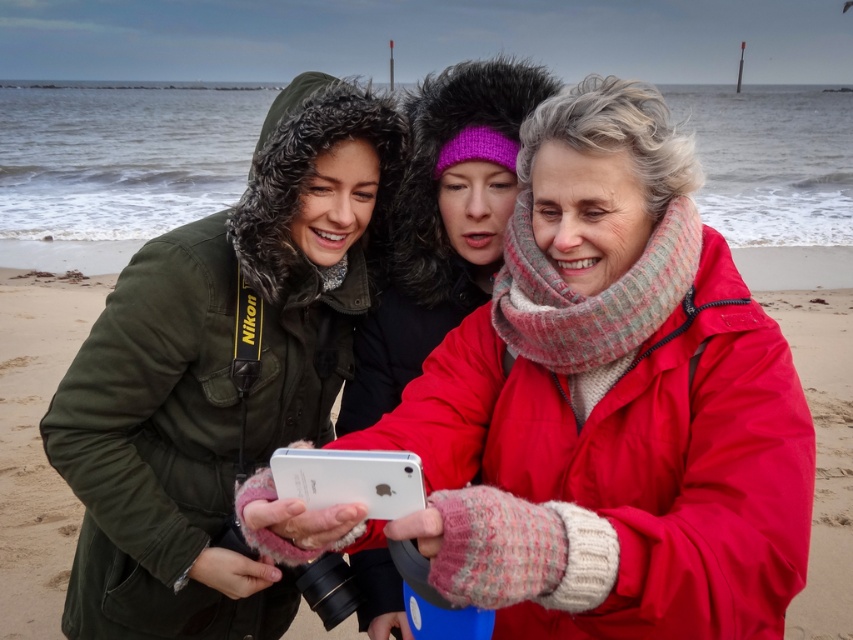
Does matte black jacket at left have a greater height compared to knitted pink scarf at center?

Indeed, matte black jacket at left has a greater height compared to knitted pink scarf at center.

Between matte black jacket at left and knitted pink scarf at center, which one has less height?

knitted pink scarf at center

What do you see at coordinates (219, 374) in the screenshot? The height and width of the screenshot is (640, 853). I see `matte black jacket at left` at bounding box center [219, 374].

This screenshot has width=853, height=640. What are the coordinates of `matte black jacket at left` in the screenshot? It's located at (219, 374).

Is matte black jacket at left positioned at the back of sandy beach at center?

No, it is in front of sandy beach at center.

Between point (202, 554) and point (35, 355), which one is positioned behind?

Point (35, 355)

What do you see at coordinates (219, 374) in the screenshot? I see `matte black jacket at left` at bounding box center [219, 374].

The image size is (853, 640). What are the coordinates of `matte black jacket at left` in the screenshot? It's located at (219, 374).

Is sandy beach at center behind knitted pink scarf at center?

Yes, it is.

Which is more to the right, sandy beach at center or knitted pink scarf at center?

From the viewer's perspective, knitted pink scarf at center appears more on the right side.

Between point (26, 310) and point (351, 400), which one is positioned in front?

Point (351, 400) is in front.

Find the location of a particular element. sandy beach at center is located at coordinates (36, 440).